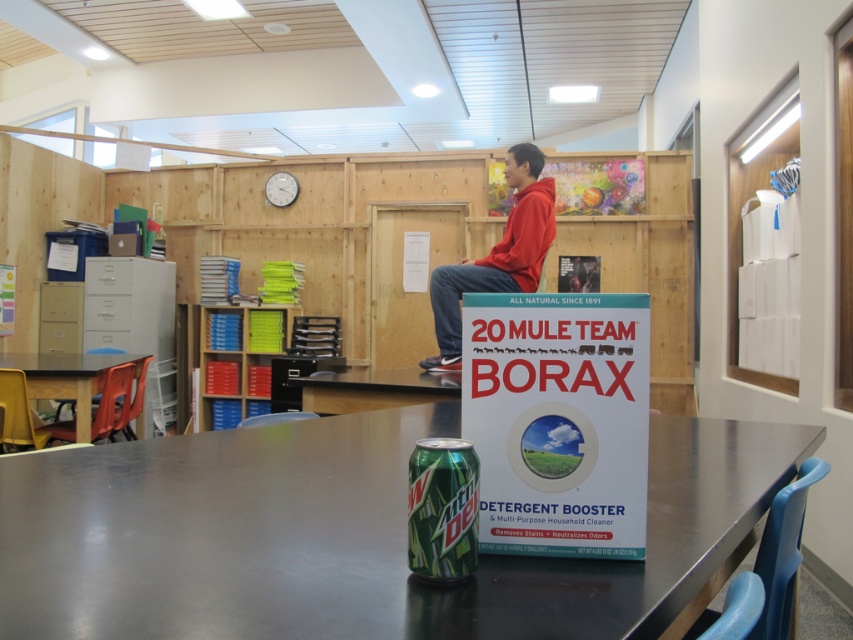
Question: Which point is farther to the camera?

Choices:
 (A) red hoodie at upper center
 (B) green matte mountain dew can at center
 (C) metallic gray table at center

Answer: (A)

Question: Is the position of metallic gray table at center less distant than that of brown wooden table at center?

Choices:
 (A) no
 (B) yes

Answer: (B)

Question: Which object appears closest to the camera in this image?

Choices:
 (A) yellow plastic table at lower left
 (B) metallic gray table at center

Answer: (B)

Question: Which is nearer to the metallic gray table at center?

Choices:
 (A) yellow plastic table at lower left
 (B) green matte mountain dew can at center
 (C) red hoodie at upper center

Answer: (B)

Question: Does brown wooden table at center come behind yellow plastic table at lower left?

Choices:
 (A) yes
 (B) no

Answer: (B)

Question: From the image, what is the correct spatial relationship of red hoodie at upper center in relation to brown wooden table at center?

Choices:
 (A) below
 (B) above

Answer: (B)